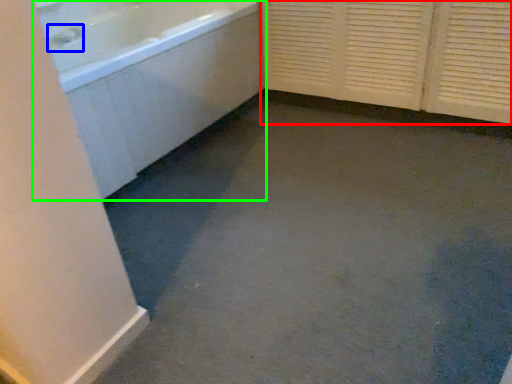
Question: Based on their relative distances, which object is nearer to screen door (highlighted by a red box)? Choose from faucet (highlighted by a blue box) and bathtub (highlighted by a green box).

Choices:
 (A) faucet
 (B) bathtub

Answer: (B)